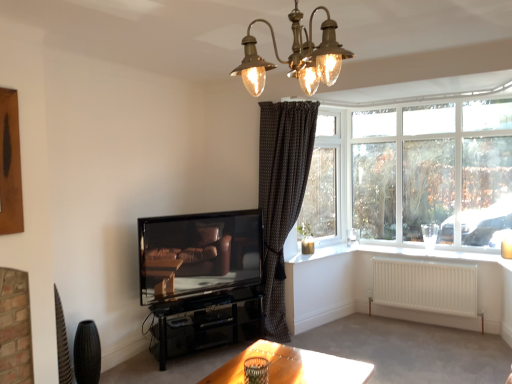
Identify the location of vacant region to the right of brown dotted fabric curtain at center. The image size is (512, 384). (344, 337).